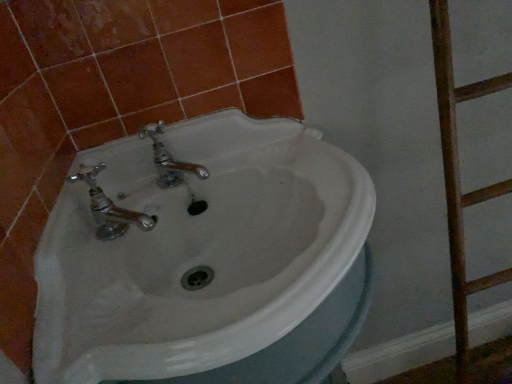
Question: Is white glossy sink at center inside the boundaries of rusty wood ladder at right, or outside?

Choices:
 (A) outside
 (B) inside

Answer: (A)

Question: Is white glossy sink at center wider or thinner than rusty wood ladder at right?

Choices:
 (A) thin
 (B) wide

Answer: (B)

Question: From a real-world perspective, is white glossy sink at center physically located above or below rusty wood ladder at right?

Choices:
 (A) below
 (B) above

Answer: (A)

Question: Looking at the image, does rusty wood ladder at right seem bigger or smaller compared to white glossy sink at center?

Choices:
 (A) big
 (B) small

Answer: (B)

Question: Considering their positions, is rusty wood ladder at right located in front of or behind white glossy sink at center?

Choices:
 (A) behind
 (B) front

Answer: (A)

Question: Looking at their shapes, would you say rusty wood ladder at right is wider or thinner than white glossy sink at center?

Choices:
 (A) wide
 (B) thin

Answer: (B)

Question: From the image's perspective, relative to white glossy sink at center, is rusty wood ladder at right above or below?

Choices:
 (A) above
 (B) below

Answer: (A)